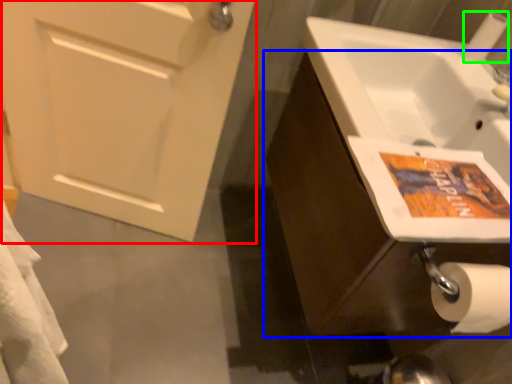
Question: Estimate the real-world distances between objects in this image. Which object is farther from door (highlighted by a red box), bathroom cabinet (highlighted by a blue box) or toilet paper (highlighted by a green box)?

Choices:
 (A) bathroom cabinet
 (B) toilet paper

Answer: (B)